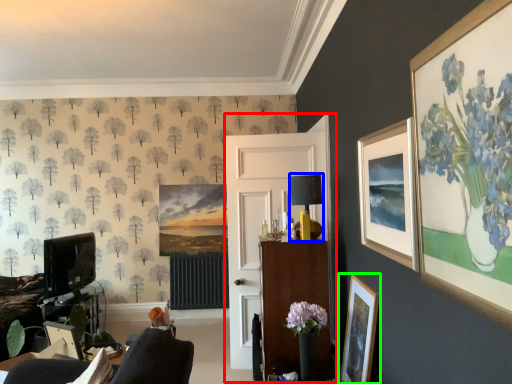
Question: Based on their relative distances, which object is nearer to side (highlighted by a red box)? Choose from lamp (highlighted by a blue box) and picture frame (highlighted by a green box).

Choices:
 (A) lamp
 (B) picture frame

Answer: (A)